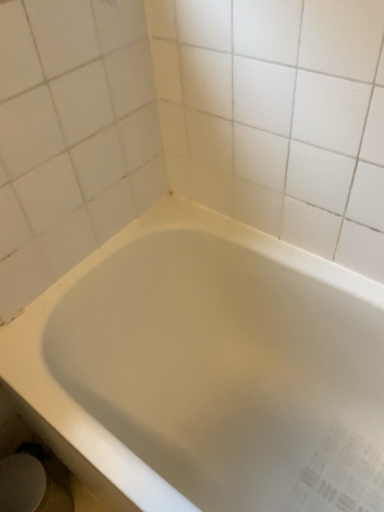
Find the location of a particular element. The image size is (384, 512). white glossy bathtub at center is located at coordinates (207, 369).

The height and width of the screenshot is (512, 384). What do you see at coordinates (207, 369) in the screenshot?
I see `white glossy bathtub at center` at bounding box center [207, 369].

At what (x,y) coordinates should I click in order to perform the action: click on white glossy bathtub at center. Please return your answer as a coordinate pair (x, y). Image resolution: width=384 pixels, height=512 pixels. Looking at the image, I should click on (207, 369).